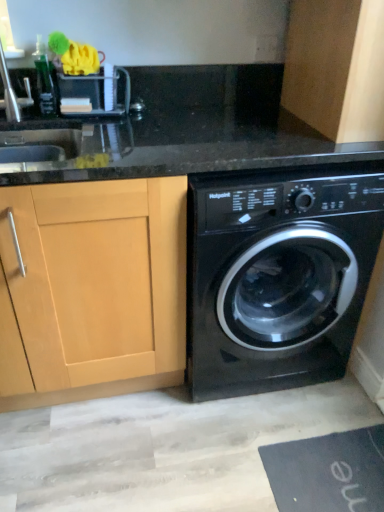
Question: From a real-world perspective, is black rubber bath mat at lower right under wooden cabinet at upper right, acting as the first cabinetry starting from the top?

Choices:
 (A) no
 (B) yes

Answer: (B)

Question: Is black rubber bath mat at lower right closer to camera compared to wooden cabinet at upper right, acting as the first cabinetry starting from the top?

Choices:
 (A) yes
 (B) no

Answer: (B)

Question: Considering the relative sizes of black rubber bath mat at lower right and wooden cabinet at upper right, acting as the first cabinetry starting from the top, in the image provided, is black rubber bath mat at lower right thinner than wooden cabinet at upper right, acting as the first cabinetry starting from the top,?

Choices:
 (A) no
 (B) yes

Answer: (A)

Question: Is black rubber bath mat at lower right at the right side of wooden cabinet at upper right, acting as the first cabinetry starting from the top?

Choices:
 (A) no
 (B) yes

Answer: (A)

Question: Can you confirm if black rubber bath mat at lower right is bigger than wooden cabinet at upper right, acting as the first cabinetry starting from the top?

Choices:
 (A) no
 (B) yes

Answer: (A)

Question: Would you say black rubber bath mat at lower right contains wooden cabinet at upper right, which is counted as the 2th cabinetry, starting from the left?

Choices:
 (A) no
 (B) yes

Answer: (A)

Question: From the image's perspective, is light wood cabinet at left, the second cabinetry in the right-to-left sequence, above black rubber bath mat at lower right?

Choices:
 (A) no
 (B) yes

Answer: (B)

Question: Does light wood cabinet at left, the first cabinetry when ordered from bottom to top, have a greater height compared to black rubber bath mat at lower right?

Choices:
 (A) no
 (B) yes

Answer: (B)

Question: Would you say black rubber bath mat at lower right is part of light wood cabinet at left, which appears as the 2th cabinetry when viewed from the top,'s contents?

Choices:
 (A) no
 (B) yes

Answer: (A)

Question: Is light wood cabinet at left, the second cabinetry in the right-to-left sequence, next to black rubber bath mat at lower right and touching it?

Choices:
 (A) yes
 (B) no

Answer: (B)

Question: Can you confirm if light wood cabinet at left, which appears as the 2th cabinetry when viewed from the top, is positioned to the right of black rubber bath mat at lower right?

Choices:
 (A) no
 (B) yes

Answer: (A)

Question: Is light wood cabinet at left, the second cabinetry in the right-to-left sequence, outside of black rubber bath mat at lower right?

Choices:
 (A) no
 (B) yes

Answer: (B)

Question: Can you confirm if black rubber bath mat at lower right is smaller than light wood cabinet at left, the second cabinetry in the right-to-left sequence?

Choices:
 (A) no
 (B) yes

Answer: (B)